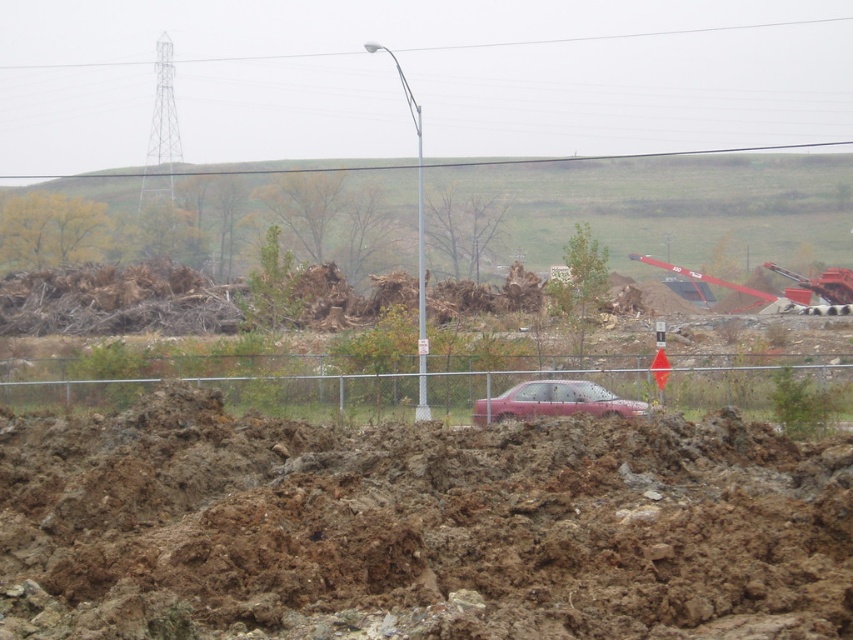
Question: Which object is farther from the camera taking this photo?

Choices:
 (A) brown muddy dirt at center
 (B) pink matte car at center

Answer: (B)

Question: Observing the image, what is the correct spatial positioning of brown muddy dirt at center in reference to pink matte car at center?

Choices:
 (A) above
 (B) below

Answer: (A)

Question: Does metallic chain-link fence at center have a smaller size compared to pink matte car at center?

Choices:
 (A) no
 (B) yes

Answer: (A)

Question: Is metallic chain-link fence at center to the right of pink matte car at center from the viewer's perspective?

Choices:
 (A) yes
 (B) no

Answer: (B)

Question: Which point is farther to the camera?

Choices:
 (A) metallic chain-link fence at center
 (B) pink matte car at center

Answer: (B)

Question: Which point is farther from the camera taking this photo?

Choices:
 (A) (618, 413)
 (B) (532, 378)
 (C) (706, 497)

Answer: (B)